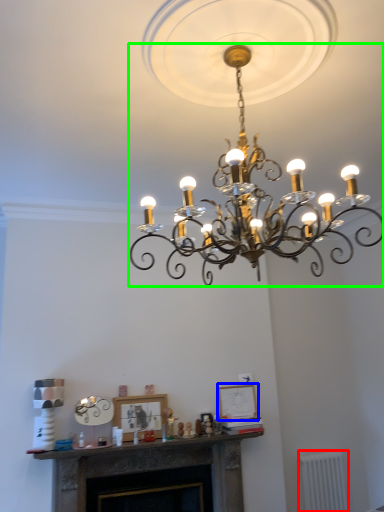
Question: Which is farther away from radiator (highlighted by a red box)? picture frame (highlighted by a blue box) or lamp (highlighted by a green box)?

Choices:
 (A) picture frame
 (B) lamp

Answer: (B)